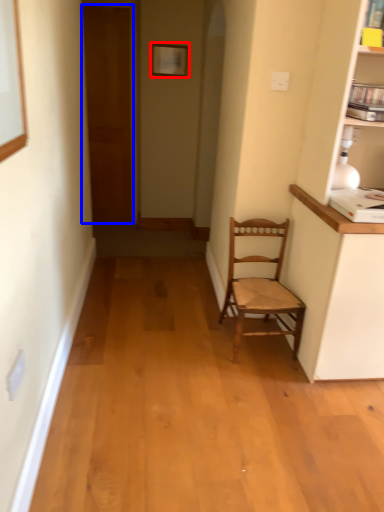
Question: Which object appears farthest to the camera in this image, picture frame (highlighted by a red box) or door (highlighted by a blue box)?

Choices:
 (A) picture frame
 (B) door

Answer: (B)